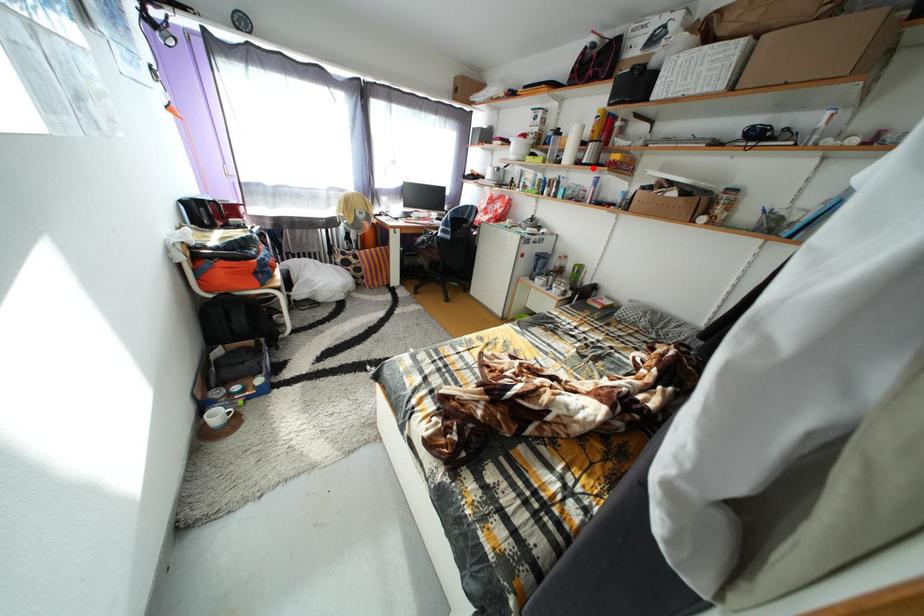
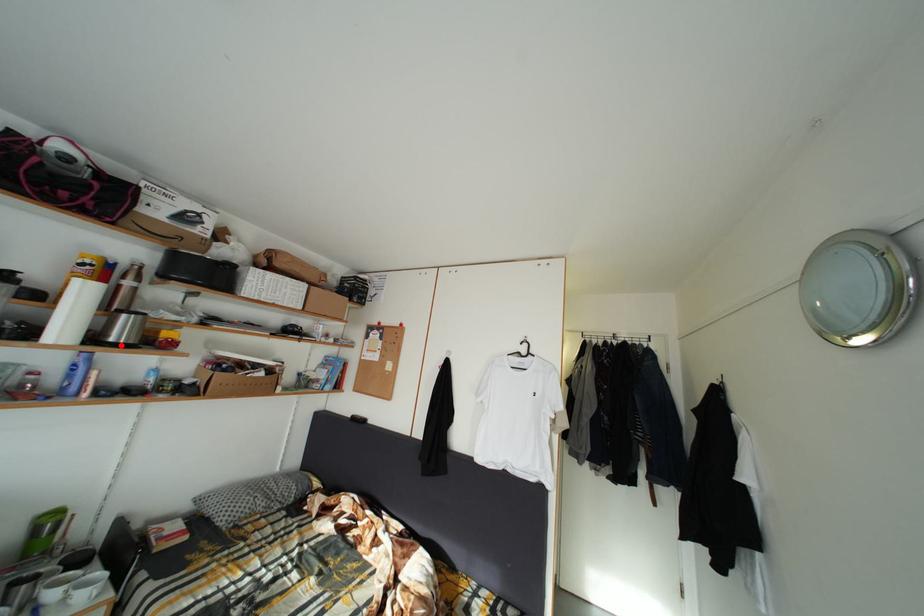
I am providing you with two images of the same scene from different viewpoints. A red point is marked on the first image and another point is marked on the second image. Does the point marked in image1 correspond to the same location as the one in image2?

Yes